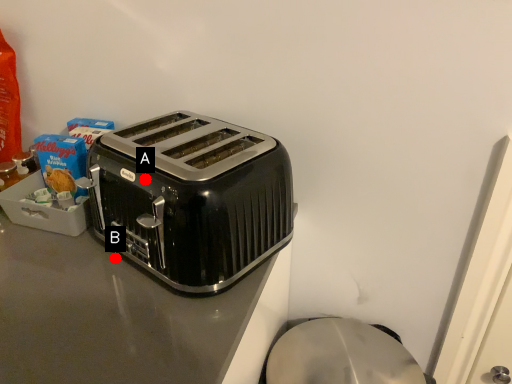
Question: Two points are circled on the image, labeled by A and B beside each circle. Which point is farther from the camera taking this photo?

Choices:
 (A) A is further
 (B) B is further

Answer: (B)